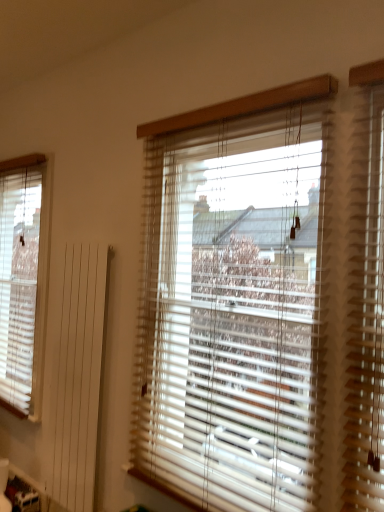
Question: Choose the correct answer: Is wooden blinds at center, which is the second window blind from back to front, inside white wood blinds at left, the first window blind viewed from the back, or outside it?

Choices:
 (A) inside
 (B) outside

Answer: (B)

Question: Is wooden blinds at center, positioned as the 1th window blind in right-to-left order, in front of or behind white wood blinds at left, the second window blind viewed from the right, in the image?

Choices:
 (A) front
 (B) behind

Answer: (A)

Question: Is point (321, 225) closer or farther from the camera than point (29, 200)?

Choices:
 (A) farther
 (B) closer

Answer: (B)

Question: Do you think white wood blinds at left, which is counted as the 1th window blind, starting from the left, is within wooden blinds at center, which ranks as the 1th window blind in front-to-back order, or outside of it?

Choices:
 (A) outside
 (B) inside

Answer: (A)

Question: Considering the positions of white wood blinds at left, the first window blind viewed from the back, and wooden blinds at center, positioned as the 1th window blind in right-to-left order, in the image, is white wood blinds at left, the first window blind viewed from the back, wider or thinner than wooden blinds at center, positioned as the 1th window blind in right-to-left order,?

Choices:
 (A) wide
 (B) thin

Answer: (B)

Question: From the image's perspective, is white wood blinds at left, the second window blind viewed from the right, positioned above or below wooden blinds at center, which is the second window blind from back to front?

Choices:
 (A) below
 (B) above

Answer: (B)

Question: Is white wood blinds at left, the second window blind viewed from the right, in front of or behind wooden blinds at center, which is the second window blind from back to front, in the image?

Choices:
 (A) front
 (B) behind

Answer: (B)